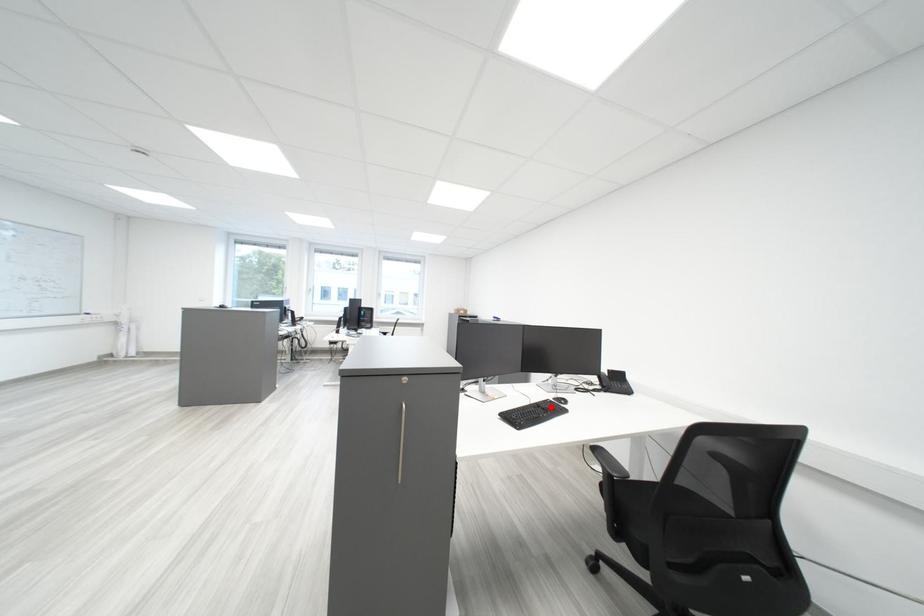
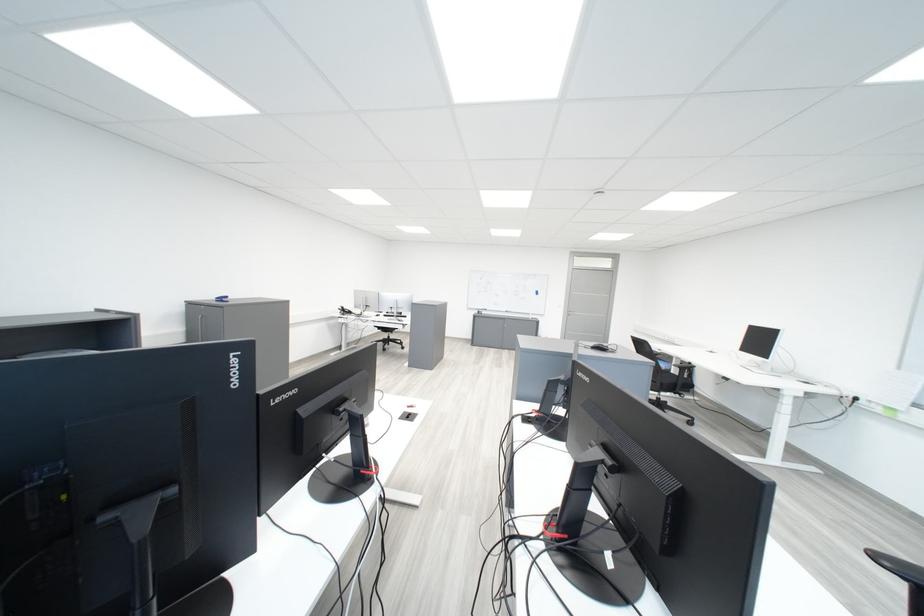
Question: I am providing you with two images of the same scene from different viewpoints. A red point is marked on the first image. At the location where the point appears in image 1, is it still visible in image 2?

Choices:
 (A) Yes
 (B) No

Answer: (B)